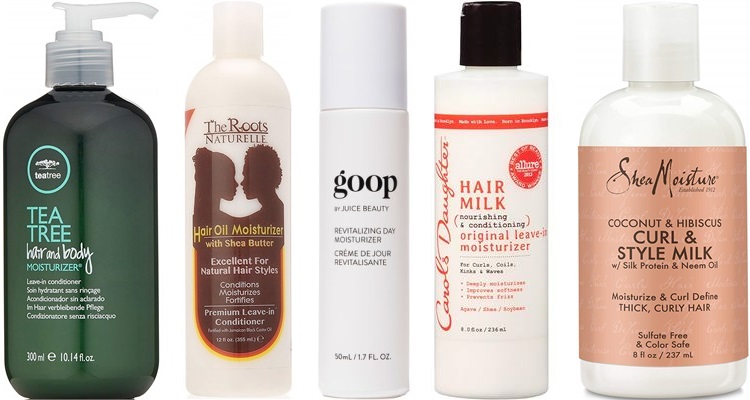
Where is `bottles hair treatment`? bottles hair treatment is located at coordinates (646, 202), (361, 195), (250, 199), (56, 223).